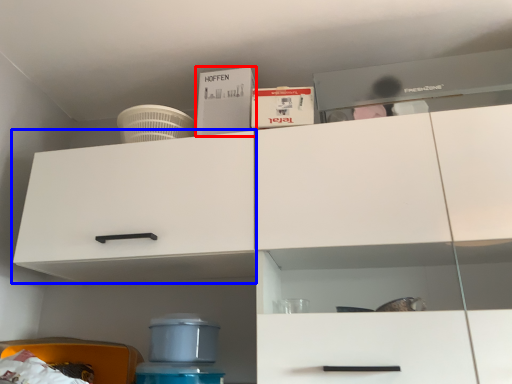
Question: Which point is closer to the camera, box (highlighted by a red box) or cabinetry (highlighted by a blue box)?

Choices:
 (A) box
 (B) cabinetry

Answer: (B)